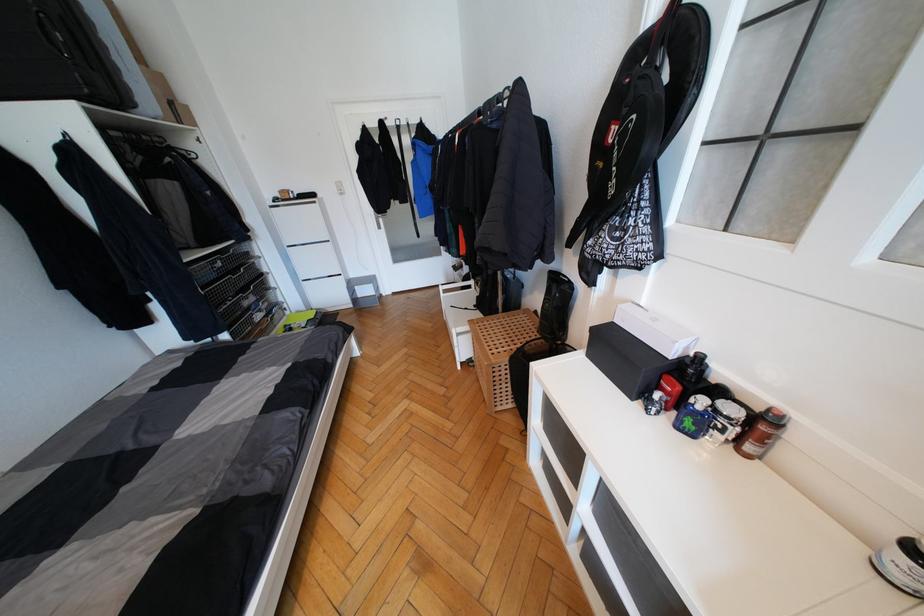
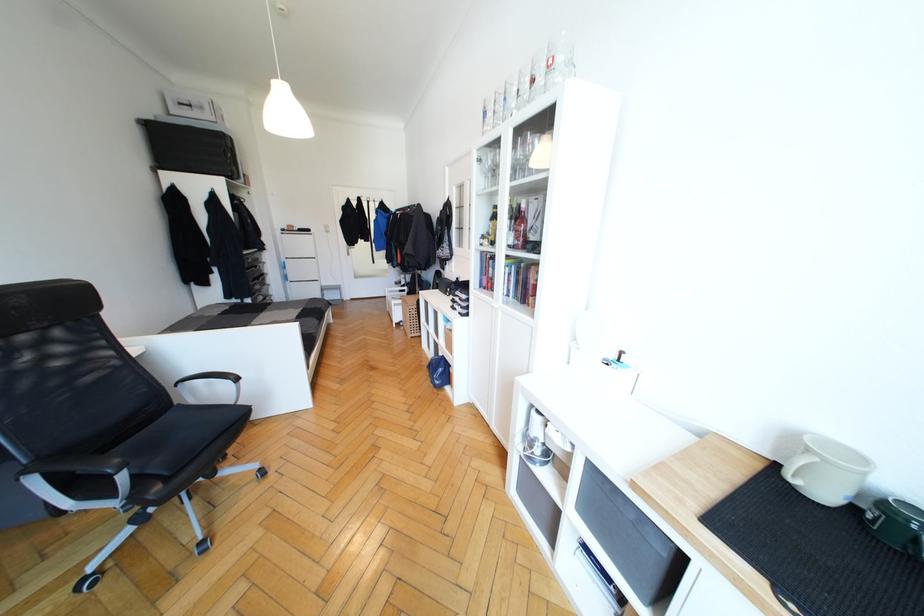
Question: I am providing you with two images of the same scene from different viewpoints. Please identify which objects are invisible in image2.

Choices:
 (A) wooden cutting board
 (B) chair sitting surface
 (C) silver perfume bottle
 (D) thermostat control dial

Answer: (C)